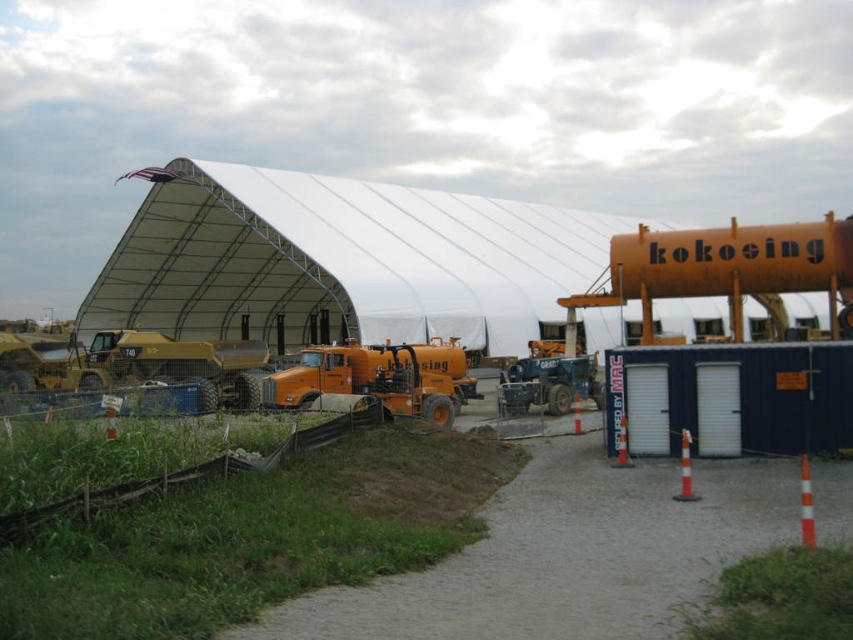
You are a construction worker who needs to move the orange matte trailer truck at center to a different location. Given the space available, can the truck be moved around the white fabric hangar at center without needing to disassemble the hangar?

The white fabric hangar at center is larger in size compared to the orange matte trailer truck at center, so there is sufficient space to maneuver the truck around the hangar without disassembling it.